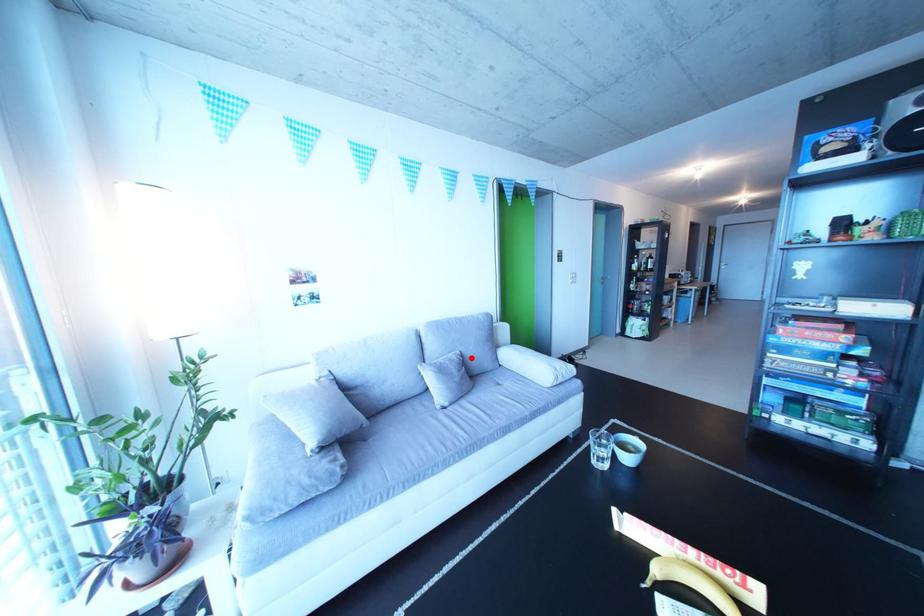
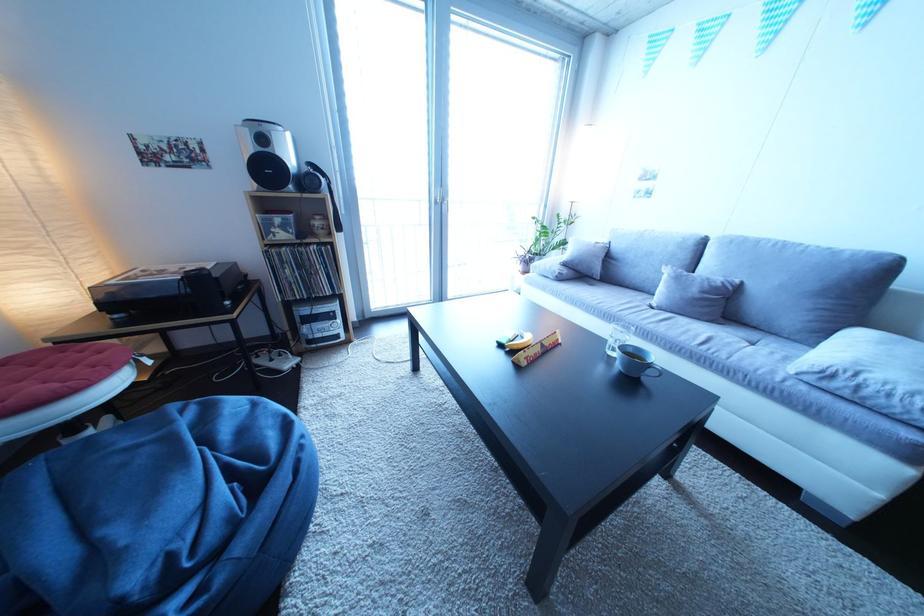
Locate, in the second image, the point that corresponds to the highlighted location in the first image.

(750, 286)